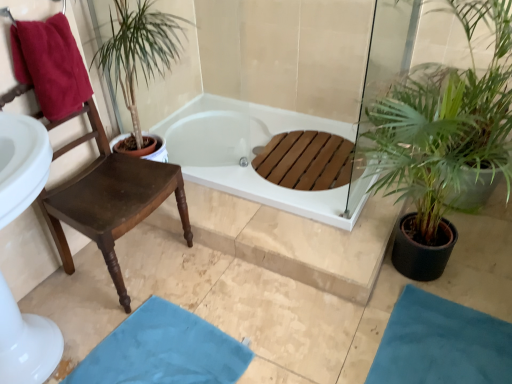
Question: Can you confirm if green leafy plant at right is thinner than blue fabric bath mat at lower right, which appears as the first bath mat when viewed from the right?

Choices:
 (A) no
 (B) yes

Answer: (A)

Question: From a real-world perspective, is green leafy plant at right positioned under blue fabric bath mat at lower right, which appears as the first bath mat when viewed from the right, based on gravity?

Choices:
 (A) no
 (B) yes

Answer: (A)

Question: Is green leafy plant at right positioned with its back to blue fabric bath mat at lower right, which ranks as the second bath mat in left-to-right order?

Choices:
 (A) no
 (B) yes

Answer: (A)

Question: Is green leafy plant at right wider than blue fabric bath mat at lower right, which ranks as the second bath mat in left-to-right order?

Choices:
 (A) yes
 (B) no

Answer: (A)

Question: Would you say blue fabric bath mat at lower right, which ranks as the second bath mat in left-to-right order, is part of green leafy plant at right's contents?

Choices:
 (A) no
 (B) yes

Answer: (A)

Question: Considering the positions of brown wood chair at left and maroon cotton towel at left in the image, is brown wood chair at left bigger or smaller than maroon cotton towel at left?

Choices:
 (A) small
 (B) big

Answer: (B)

Question: In the image, is brown wood chair at left on the left side or the right side of maroon cotton towel at left?

Choices:
 (A) left
 (B) right

Answer: (B)

Question: From a real-world perspective, is brown wood chair at left positioned above or below maroon cotton towel at left?

Choices:
 (A) above
 (B) below

Answer: (B)

Question: In the image, is brown wood chair at left positioned in front of or behind maroon cotton towel at left?

Choices:
 (A) behind
 (B) front

Answer: (B)

Question: From a real-world perspective, is green leafy plant at right physically located above or below blue fabric bath mat at lower right, which appears as the first bath mat when viewed from the right?

Choices:
 (A) below
 (B) above

Answer: (B)

Question: From the image's perspective, is green leafy plant at right above or below blue fabric bath mat at lower right, which appears as the first bath mat when viewed from the right?

Choices:
 (A) above
 (B) below

Answer: (A)

Question: Looking at the image, does green leafy plant at right seem bigger or smaller compared to blue fabric bath mat at lower right, which ranks as the second bath mat in left-to-right order?

Choices:
 (A) small
 (B) big

Answer: (B)

Question: Would you say green leafy plant at right is to the left or to the right of blue fabric bath mat at lower right, which ranks as the second bath mat in left-to-right order, in the picture?

Choices:
 (A) right
 (B) left

Answer: (A)

Question: Considering the positions of blue fabric bath mat at lower center, placed as the first bath mat when sorted from left to right, and white glossy bathtub at center in the image, is blue fabric bath mat at lower center, placed as the first bath mat when sorted from left to right, taller or shorter than white glossy bathtub at center?

Choices:
 (A) short
 (B) tall

Answer: (A)

Question: Considering the relative positions of blue fabric bath mat at lower center, which is counted as the 2th bath mat, starting from the right, and white glossy bathtub at center in the image provided, is blue fabric bath mat at lower center, which is counted as the 2th bath mat, starting from the right, to the left or to the right of white glossy bathtub at center?

Choices:
 (A) left
 (B) right

Answer: (A)